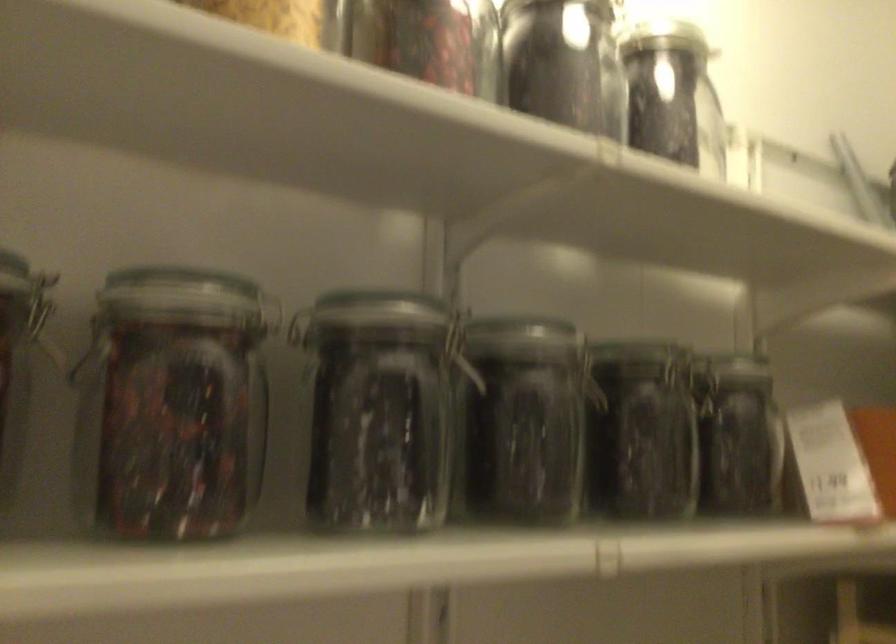
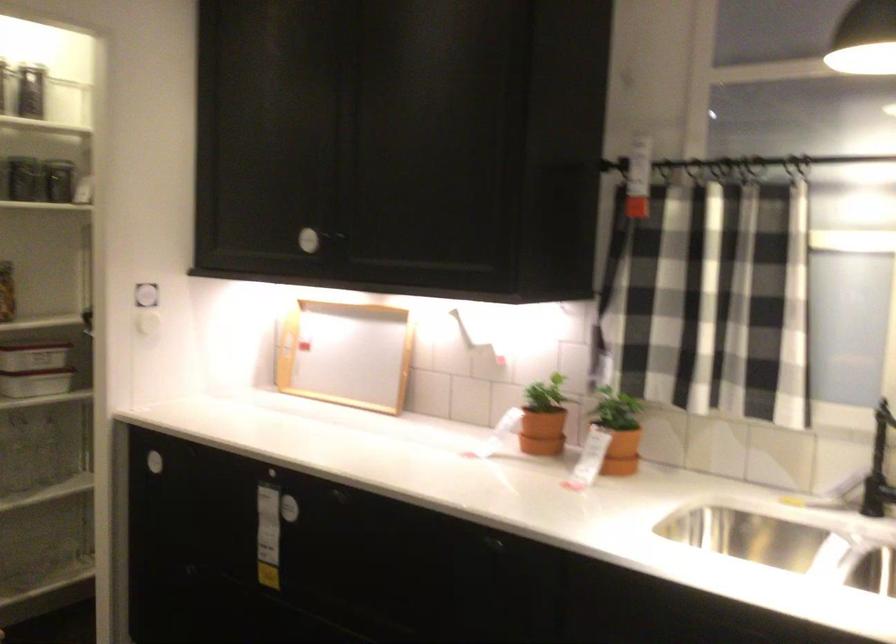
Locate, in the second image, the point that corresponds to [692,98] in the first image.

(39, 91)